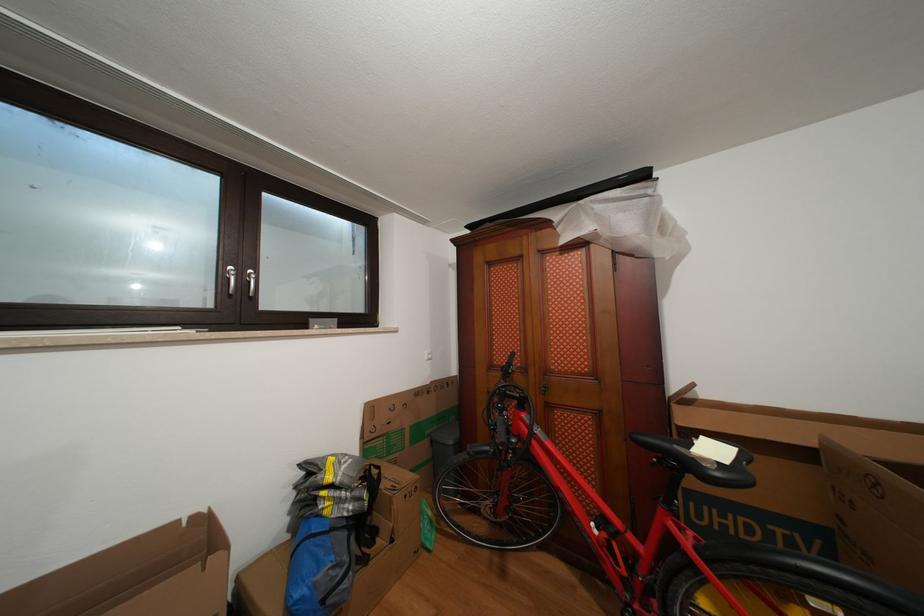
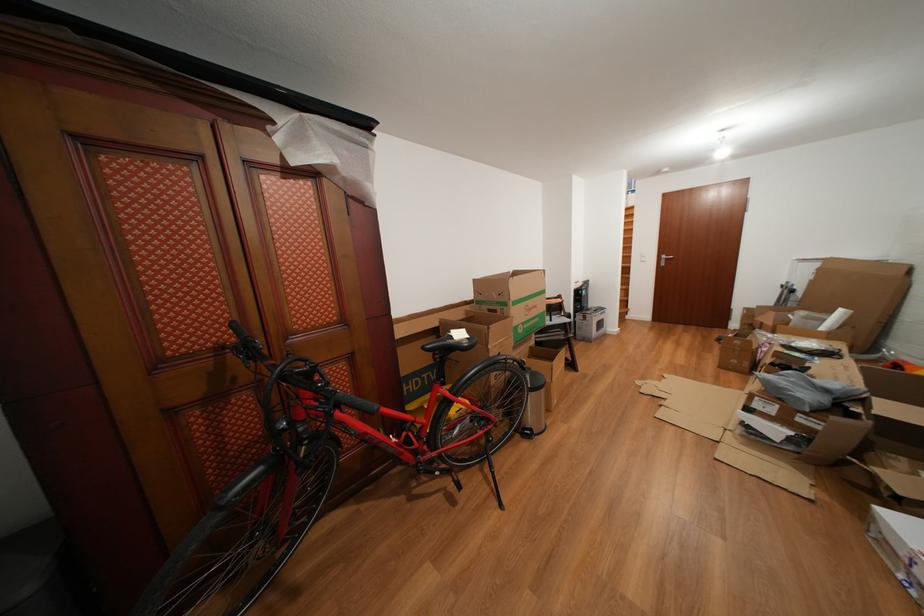
The point at (821,448) is marked in the first image. Where is the corresponding point in the second image?

(445, 330)